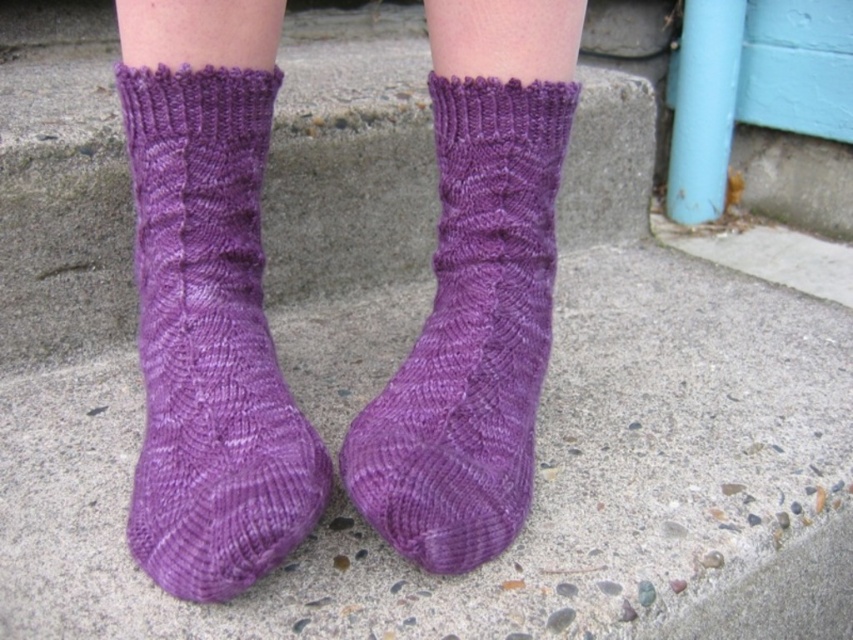
Question: Among these objects, which one is farthest from the camera?

Choices:
 (A) purple knitted sock at center
 (B) purple knitted sock at left

Answer: (A)

Question: Can you confirm if purple knitted sock at left is thinner than purple knitted sock at center?

Choices:
 (A) yes
 (B) no

Answer: (B)

Question: Is purple knitted sock at left wider than purple knitted sock at center?

Choices:
 (A) yes
 (B) no

Answer: (A)

Question: Among these points, which one is nearest to the camera?

Choices:
 (A) (453, 502)
 (B) (281, 428)

Answer: (A)

Question: Does purple knitted sock at left appear under purple knitted sock at center?

Choices:
 (A) yes
 (B) no

Answer: (A)